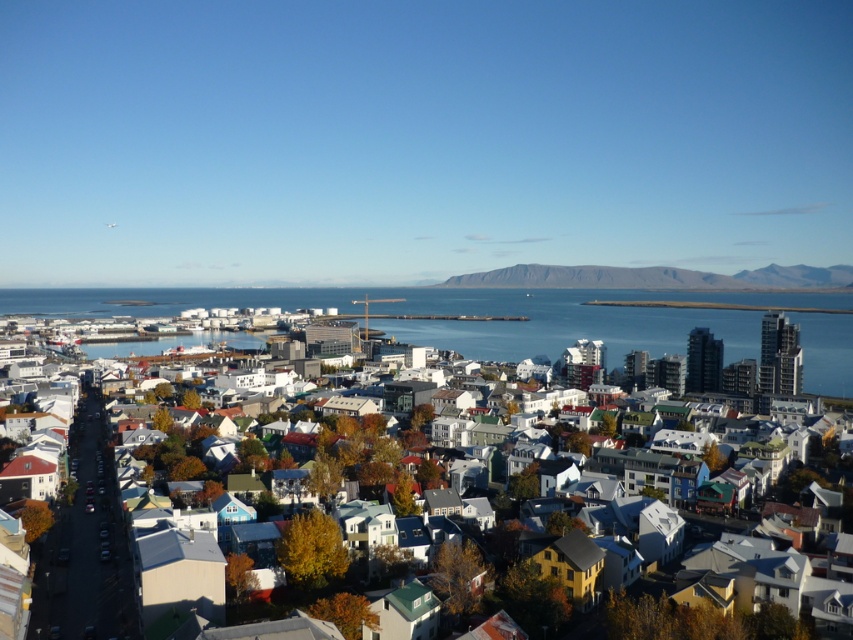
You are a delivery drone with a wingspan of 1.5 meters. You need to fly through the gap between the blue water at center and the rocky gray cliff at center. Can you safely pass through this gap without touching either the cliff or the water?

The gap between the blue water at center and the rocky gray cliff at center is 93.87 meters wide. Since your wingspan is only 1.5 meters, there is ample space for the drone to pass safely through the gap without touching either the cliff or the water.

You are a drone operator tasked with capturing aerial footage of the coastal city. You notice the white matte buildings at center and the blue water at center. Which object should you focus on first to ensure the other remains in the background?

You should focus on the white matte buildings at center first because they are behind the blue water at center, so keeping them in the background requires the blue water at center to be in the foreground of the shot.

You are standing at the observation deck of the tallest building in the city. You see two points in the scene, point (167, 340) and point (524, 264). Which point is closer to you?

Point (167, 340) is closer to the camera than point (524, 264), so the point closer to you is point (167, 340).